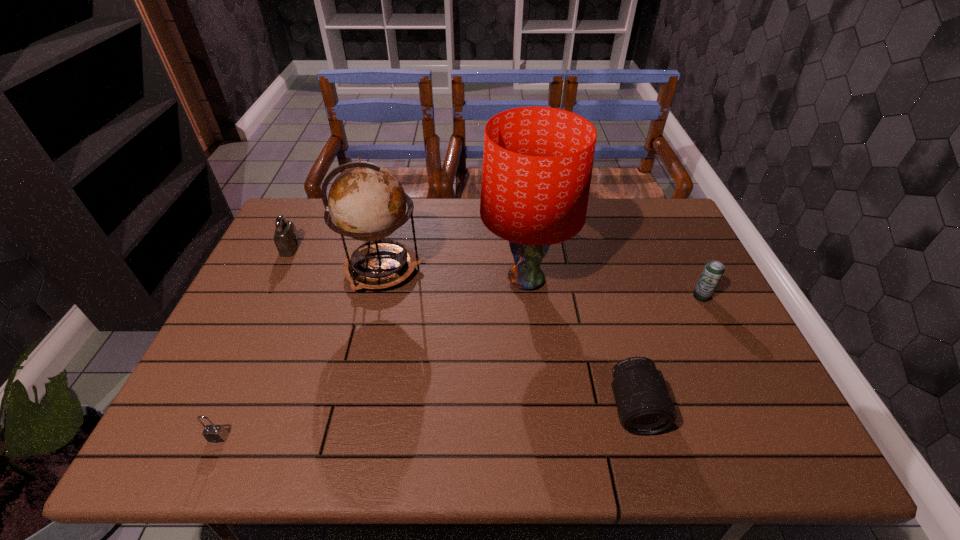
Find the location of `free space between the beer can and the lampshade`. free space between the beer can and the lampshade is located at coordinates [613, 288].

This screenshot has height=540, width=960. Find the location of `free space between the farther padlock and the telephoto lens`. free space between the farther padlock and the telephoto lens is located at coordinates (463, 328).

This screenshot has width=960, height=540. I want to click on blank region between the globe and the farther padlock, so click(x=336, y=259).

Locate an element on the screen. vacant area between the taller padlock and the shorter padlock is located at coordinates (254, 343).

The width and height of the screenshot is (960, 540). What are the coordinates of `the fourth closest object to the third object from right to left` in the screenshot? It's located at (286, 238).

Find the location of a particular element. This screenshot has width=960, height=540. object that is the fourth nearest to the fifth object from left to right is located at coordinates (212, 433).

This screenshot has width=960, height=540. What are the coordinates of `free location that satisfies the following two spatial constraints: 1. at the front of the beer can near the keyhole; 2. on the left side of the farther padlock` in the screenshot? It's located at (267, 296).

Find the location of a particular element. The height and width of the screenshot is (540, 960). free space that satisfies the following two spatial constraints: 1. at the center of the globe; 2. on the left side of the beer can is located at coordinates (376, 296).

The image size is (960, 540). I want to click on free space in the image that satisfies the following two spatial constraints: 1. at the center of the beer can; 2. on the left side of the third object from left to right, so click(x=376, y=296).